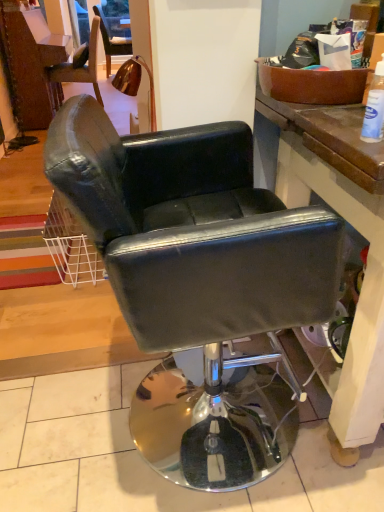
Question: From a real-world perspective, does white plastic bottle at upper right sit lower than black leather chair at center?

Choices:
 (A) yes
 (B) no

Answer: (B)

Question: Can you confirm if white plastic bottle at upper right is wider than black leather chair at center?

Choices:
 (A) no
 (B) yes

Answer: (A)

Question: Considering the relative sizes of white plastic bottle at upper right and black leather chair at center in the image provided, is white plastic bottle at upper right smaller than black leather chair at center?

Choices:
 (A) yes
 (B) no

Answer: (A)

Question: Does white plastic bottle at upper right turn towards black leather chair at center?

Choices:
 (A) no
 (B) yes

Answer: (A)

Question: Does white plastic bottle at upper right have a lesser height compared to black leather chair at center?

Choices:
 (A) no
 (B) yes

Answer: (B)

Question: Are white plastic bottle at upper right and black leather chair at center far apart?

Choices:
 (A) yes
 (B) no

Answer: (B)

Question: From a real-world perspective, is black leather chair at center physically below white plastic bottle at upper right?

Choices:
 (A) yes
 (B) no

Answer: (A)

Question: Is black leather chair at center smaller than white plastic bottle at upper right?

Choices:
 (A) yes
 (B) no

Answer: (B)

Question: Is black leather chair at center wider than white plastic bottle at upper right?

Choices:
 (A) no
 (B) yes

Answer: (B)

Question: Considering the relative sizes of black leather chair at center and white plastic bottle at upper right in the image provided, is black leather chair at center taller than white plastic bottle at upper right?

Choices:
 (A) yes
 (B) no

Answer: (A)

Question: Is black leather chair at center further to the viewer compared to white plastic bottle at upper right?

Choices:
 (A) yes
 (B) no

Answer: (B)

Question: Is black leather chair at center oriented towards white plastic bottle at upper right?

Choices:
 (A) no
 (B) yes

Answer: (A)

Question: In the image, is black leather chair at center positioned in front of or behind white plastic bottle at upper right?

Choices:
 (A) front
 (B) behind

Answer: (A)